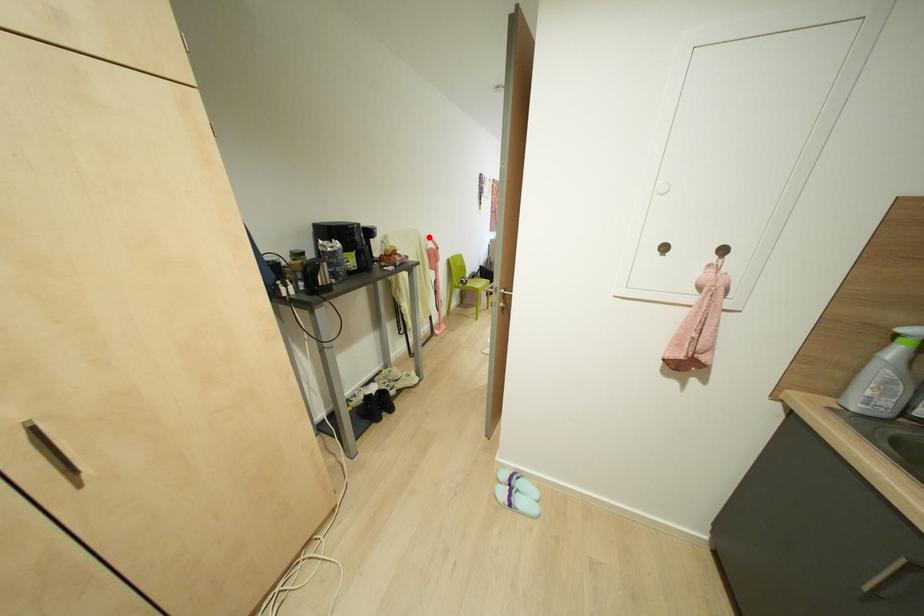
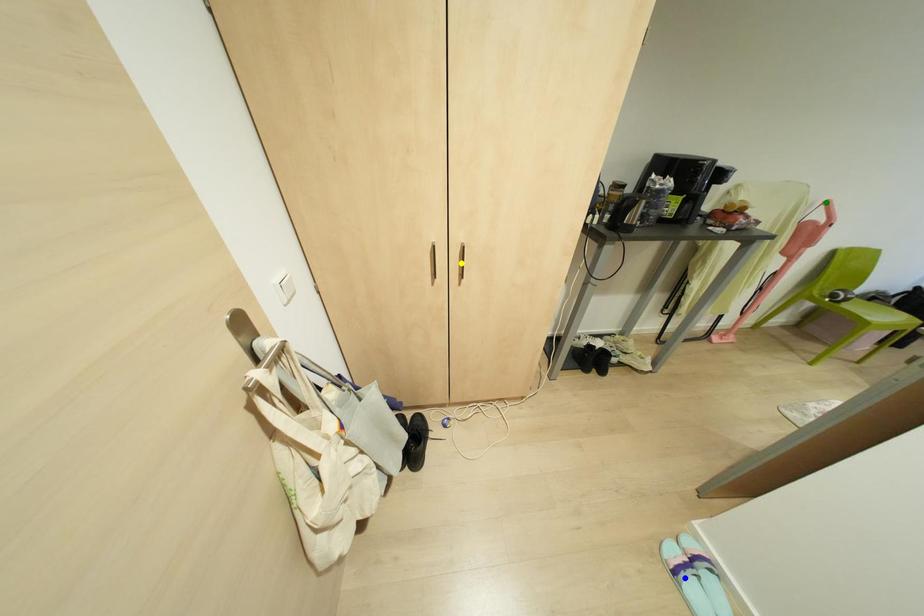
Question: I am providing you with two images of the same scene from different viewpoints. A red point is marked on the first image. You are given multiple points on the second image. Which spot in image 2 lines up with the point in image 1?

Choices:
 (A) green point
 (B) yellow point
 (C) blue point

Answer: (A)